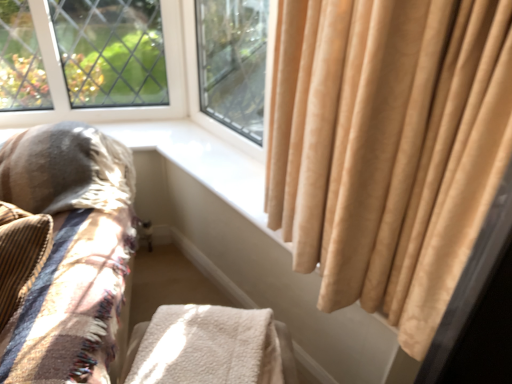
Image resolution: width=512 pixels, height=384 pixels. What do you see at coordinates (208, 347) in the screenshot?
I see `white fluffy blanket at lower center` at bounding box center [208, 347].

Measure the distance between point (144, 367) and camera.

Point (144, 367) and camera are 37.87 inches apart.

This screenshot has width=512, height=384. I want to click on white fluffy blanket at lower center, so click(x=208, y=347).

Locate an element on the screen. Image resolution: width=512 pixels, height=384 pixels. plush beige cushion at left is located at coordinates (70, 251).

Describe the element at coordinates (70, 251) in the screenshot. I see `plush beige cushion at left` at that location.

Where is `white fluffy blanket at lower center`? white fluffy blanket at lower center is located at coordinates (208, 347).

Is plush beige cushion at left at the right side of white fluffy blanket at lower center?

In fact, plush beige cushion at left is to the left of white fluffy blanket at lower center.

Does plush beige cushion at left lie behind white fluffy blanket at lower center?

No, plush beige cushion at left is closer to the viewer.

Is point (91, 163) positioned behind point (172, 331)?

Yes, point (91, 163) is behind point (172, 331).

From the image's perspective, between plush beige cushion at left and white fluffy blanket at lower center, who is located below?

white fluffy blanket at lower center is shown below in the image.

From a real-world perspective, which object rests below the other?

plush beige cushion at left, from a real-world perspective.

Which object is thinner, plush beige cushion at left or white fluffy blanket at lower center?

white fluffy blanket at lower center is thinner.

Is plush beige cushion at left shorter than white fluffy blanket at lower center?

Incorrect, the height of plush beige cushion at left does not fall short of that of white fluffy blanket at lower center.

Who is smaller, plush beige cushion at left or white fluffy blanket at lower center?

white fluffy blanket at lower center.

In the scene shown: Is plush beige cushion at left outside of white fluffy blanket at lower center?

Absolutely, plush beige cushion at left is external to white fluffy blanket at lower center.

Is plush beige cushion at left next to white fluffy blanket at lower center?

No.

Is white fluffy blanket at lower center at the back of plush beige cushion at left?

No.

Can you tell me how much plush beige cushion at left and white fluffy blanket at lower center differ in facing direction?

The angle between the facing direction of plush beige cushion at left and the facing direction of white fluffy blanket at lower center is 8.71 degrees.

I want to click on blanket located above the plush beige cushion at left (from a real-world perspective), so click(208, 347).

Which is more to the right, white fluffy blanket at lower center or plush beige cushion at left?

Positioned to the right is white fluffy blanket at lower center.

Is white fluffy blanket at lower center further to the viewer compared to plush beige cushion at left?

Yes, the depth of white fluffy blanket at lower center is greater than that of plush beige cushion at left.

Considering the positions of points (251, 372) and (27, 168), is point (251, 372) closer to camera compared to point (27, 168)?

Yes, it is.

From the image's perspective, who appears lower, white fluffy blanket at lower center or plush beige cushion at left?

white fluffy blanket at lower center appears lower in the image.

From a real-world perspective, which object stands above the other?

In real-world perspective, white fluffy blanket at lower center is above.

Does white fluffy blanket at lower center have a lesser width compared to plush beige cushion at left?

Indeed, white fluffy blanket at lower center has a lesser width compared to plush beige cushion at left.

Considering the sizes of objects white fluffy blanket at lower center and plush beige cushion at left in the image provided, who is shorter, white fluffy blanket at lower center or plush beige cushion at left?

With less height is white fluffy blanket at lower center.

Considering the relative sizes of white fluffy blanket at lower center and plush beige cushion at left in the image provided, is white fluffy blanket at lower center smaller than plush beige cushion at left?

Yes.

Is plush beige cushion at left inside white fluffy blanket at lower center?

No, plush beige cushion at left is located outside of white fluffy blanket at lower center.

Is white fluffy blanket at lower center far away from plush beige cushion at left?

No, white fluffy blanket at lower center is not far away from plush beige cushion at left.

Is white fluffy blanket at lower center facing away from plush beige cushion at left?

No, plush beige cushion at left is not at the back of white fluffy blanket at lower center.

Can you tell me how much white fluffy blanket at lower center and plush beige cushion at left differ in facing direction?

The angle between the facing direction of white fluffy blanket at lower center and the facing direction of plush beige cushion at left is 8.71 degrees.

Locate an element on the screen. The width and height of the screenshot is (512, 384). blanket that is below the plush beige cushion at left (from the image's perspective) is located at coordinates (208, 347).

This screenshot has width=512, height=384. I want to click on blanket to the right of plush beige cushion at left, so click(208, 347).

Find the location of a particular element. blanket above the plush beige cushion at left (from a real-world perspective) is located at coordinates (208, 347).